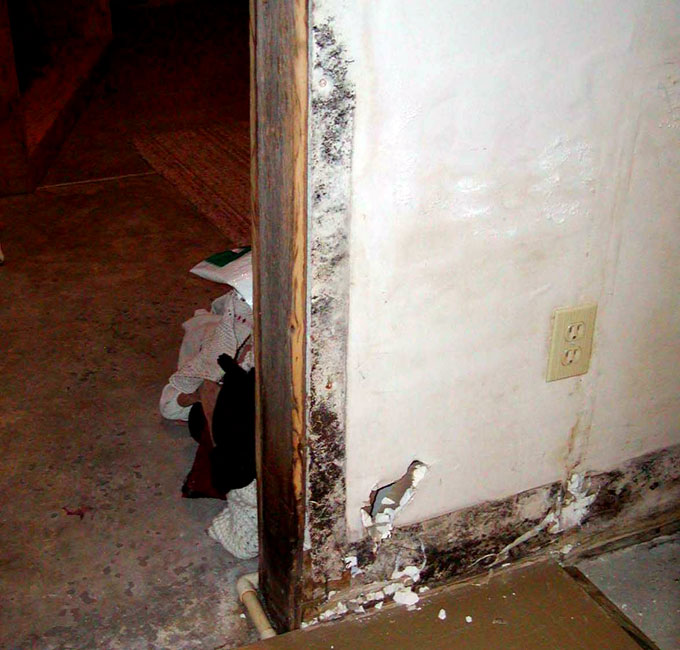
Locate an element on the screen. The image size is (680, 650). electrical outlet is located at coordinates (589, 316).